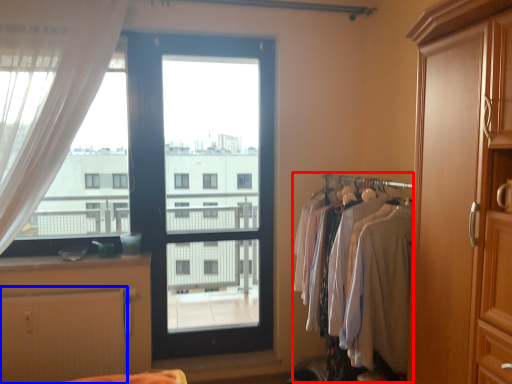
Question: Among these objects, which one is nearest to the camera, laundry (highlighted by a red box) or radiator (highlighted by a blue box)?

Choices:
 (A) laundry
 (B) radiator

Answer: (A)